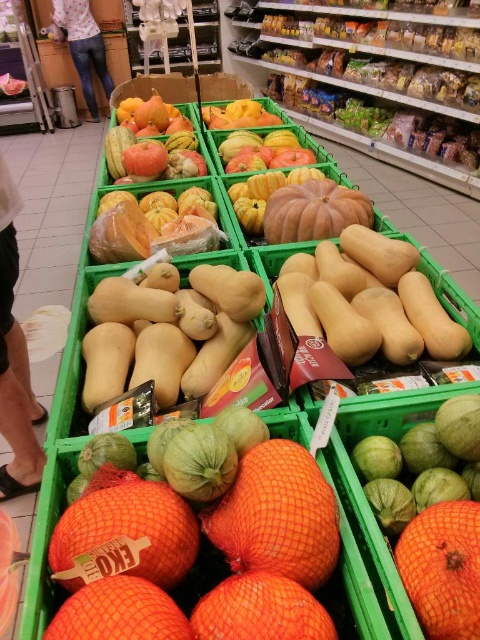
Question: Which object is the farthest from the smooth yellow squash at center?

Choices:
 (A) netted orange fruit at center
 (B) smooth orange pumpkin at upper left
 (C) orange mesh grapefruit at center

Answer: (B)

Question: Which of the following is the farthest from the observer?

Choices:
 (A) shiny orange melon at center
 (B) ripe red apples at center

Answer: (B)

Question: Which object is positioned farthest from the netted orange fruit at center?

Choices:
 (A) orange mesh bag at center
 (B) smooth yellow mangoes at center
 (C) ripe red apples at center

Answer: (B)

Question: Does orange mesh bag at center have a smaller size compared to ripe red apples at center?

Choices:
 (A) no
 (B) yes

Answer: (B)

Question: Where is shiny orange melon at center located in relation to smooth orange pumpkin at upper left in the image?

Choices:
 (A) above
 (B) below

Answer: (B)

Question: Is the position of ripe red apples at center more distant than that of smooth yellow mangoes at center?

Choices:
 (A) no
 (B) yes

Answer: (A)